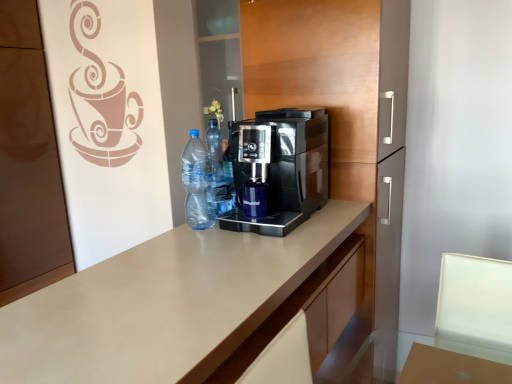
Locate an element on the screen. The image size is (512, 384). free space in front of black glossy coffee maker at center is located at coordinates (207, 269).